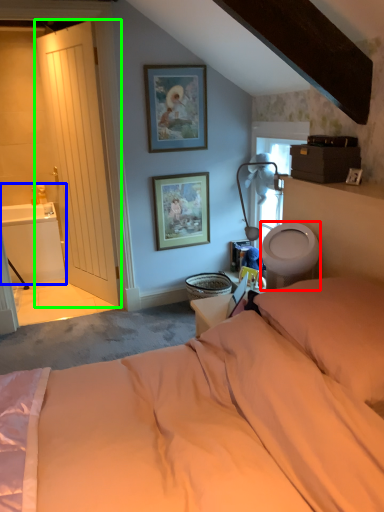
Question: Which is farther away from toilet bowl (highlighted by a red box)? sink (highlighted by a blue box) or door (highlighted by a green box)?

Choices:
 (A) sink
 (B) door

Answer: (A)